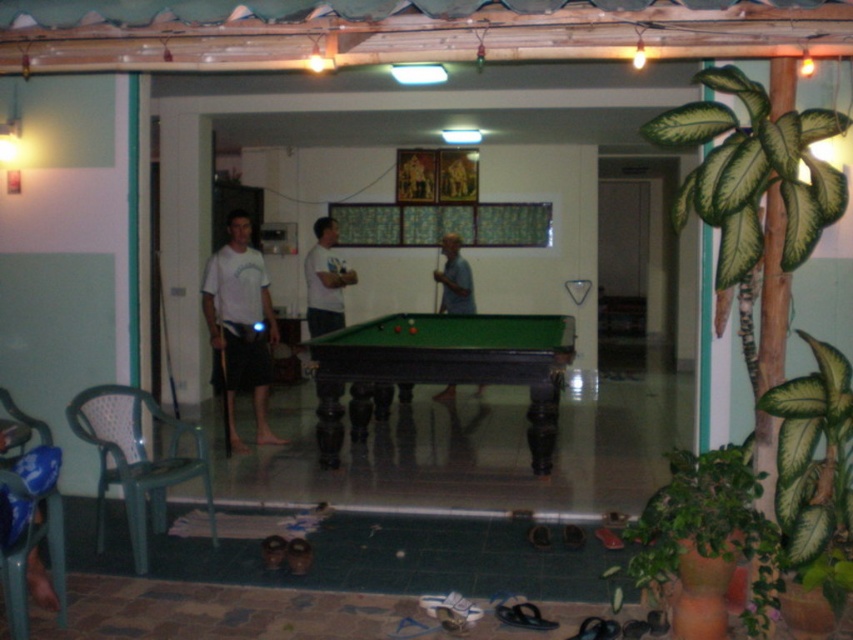
You are a guest entering the room and see the green matte plant at lower right and the matte white shirt at center. Which object is closer to the floor?

The green matte plant at lower right is positioned under the matte white shirt at center, so it is closer to the floor.